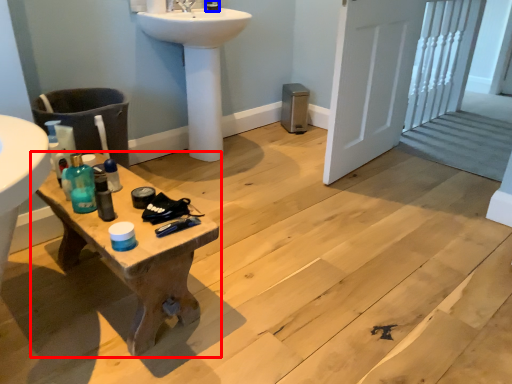
Question: Among these objects, which one is farthest to the camera, table (highlighted by a red box) or toiletry (highlighted by a blue box)?

Choices:
 (A) table
 (B) toiletry

Answer: (B)